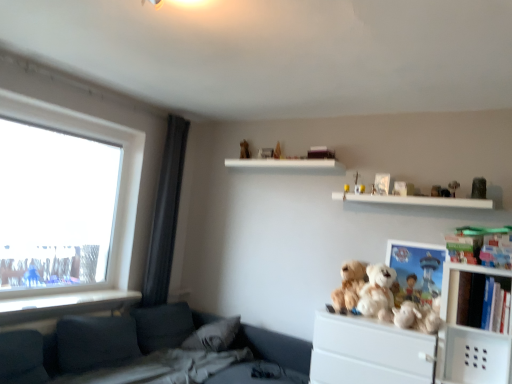
Question: Is fluffy white teddy bear at center-right, which is counted as the 5th toy, starting from the right, to the left or to the right of white plush bear at upper right, acting as the 2th toy starting from the right, in the image?

Choices:
 (A) left
 (B) right

Answer: (A)

Question: From a real-world perspective, is fluffy white teddy bear at center-right, which is counted as the 4th toy, starting from the left, positioned above or below white plush bear at upper right, acting as the 2th toy starting from the right?

Choices:
 (A) above
 (B) below

Answer: (B)

Question: Which of these objects is positioned closest to the white plastic drawer at lower right?

Choices:
 (A) gray fabric pillow at lower left
 (B) fluffy white stuffed toys at upper right, which ranks as the eighth toy in right-to-left order
 (C) white plush bear at upper center, the sixth toy positioned from the right
 (D) white plastic cabinet at right
 (E) fluffy white teddy bear at center-right, which is counted as the 4th toy, starting from the left

Answer: (D)

Question: Which of these objects is positioned closest to the matte plastic picture frame at center-right?

Choices:
 (A) white plush bear at upper center, acting as the 6th toy starting from the left
 (B) gray fabric pillow at lower left
 (C) dark gray fabric curtain at left
 (D) yellow plush toy at upper center, arranged as the 2th toy when viewed from the left
 (E) white plush toy at upper right, the fifth toy when ordered from left to right

Answer: (E)